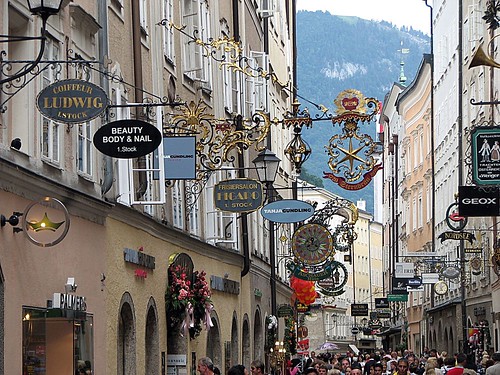
Where is `stone arch wall`? This screenshot has width=500, height=375. stone arch wall is located at coordinates (130, 327), (153, 343), (218, 347), (234, 346), (245, 352), (259, 350).